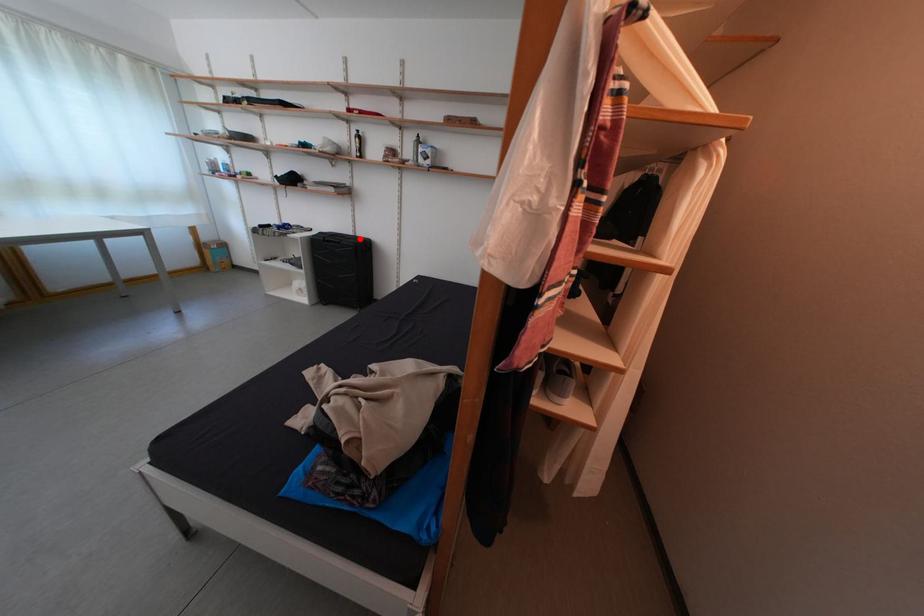
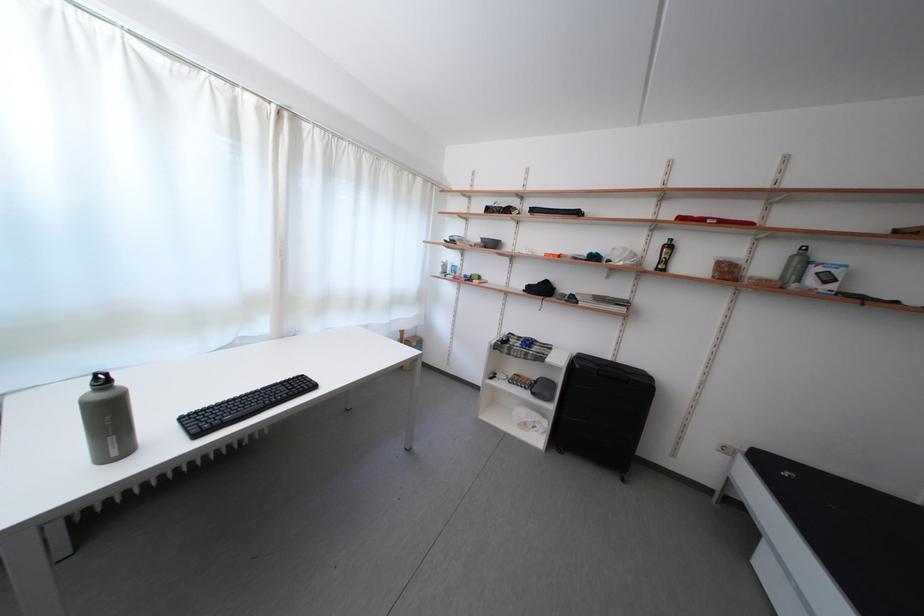
Locate, in the second image, the point that corresponds to the highlighted location in the first image.

(617, 363)